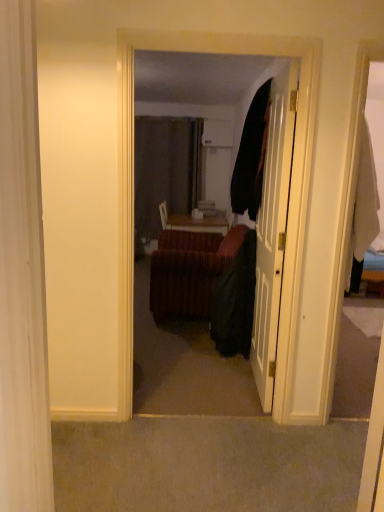
Question: From a real-world perspective, relative to velvet couch at center, is white glossy door at center vertically above or below?

Choices:
 (A) below
 (B) above

Answer: (A)

Question: In terms of width, does white glossy door at center look wider or thinner when compared to velvet couch at center?

Choices:
 (A) thin
 (B) wide

Answer: (B)

Question: Based on their relative distances, which object is nearer to the black fabric robe at center?

Choices:
 (A) velvet couch at center
 (B) velvet-like brown couch at center
 (C) white glossy door at center

Answer: (C)

Question: Which object is the closest to the velvet couch at center?

Choices:
 (A) white glossy door at center
 (B) velvet-like brown couch at center
 (C) black fabric robe at center

Answer: (A)